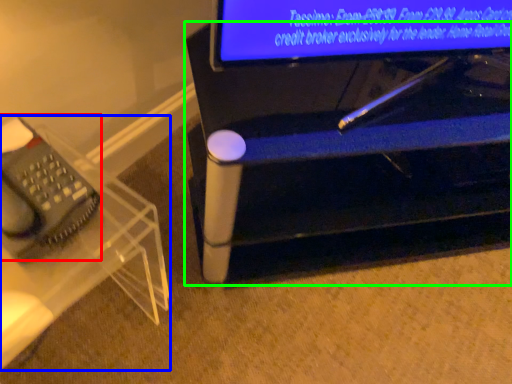
Question: Based on their relative distances, which object is farther from equipment (highlighted by a red box)? Choose from furniture (highlighted by a blue box) and furniture (highlighted by a green box).

Choices:
 (A) furniture
 (B) furniture

Answer: (B)